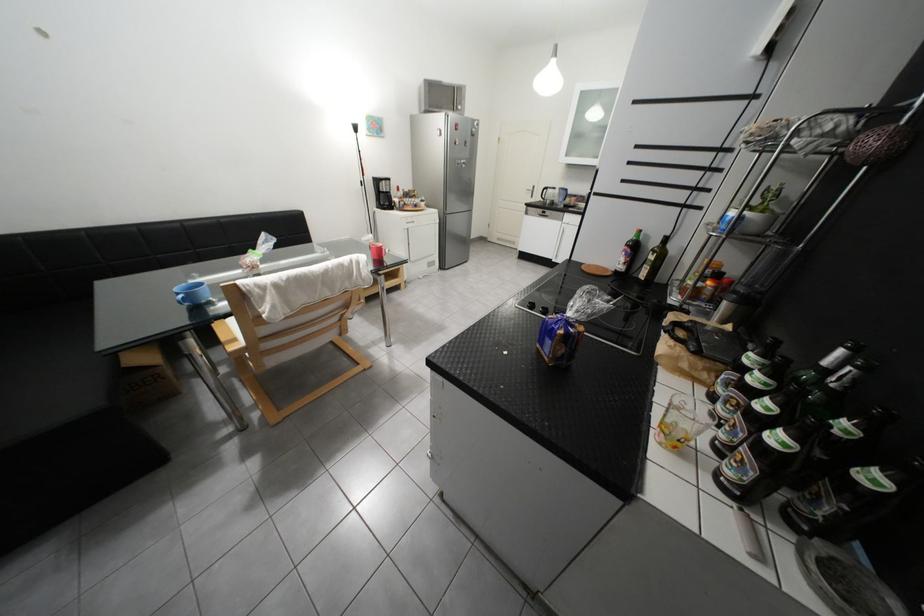
This screenshot has width=924, height=616. What are the coordinates of `black kettle handle` in the screenshot? It's located at (545, 192).